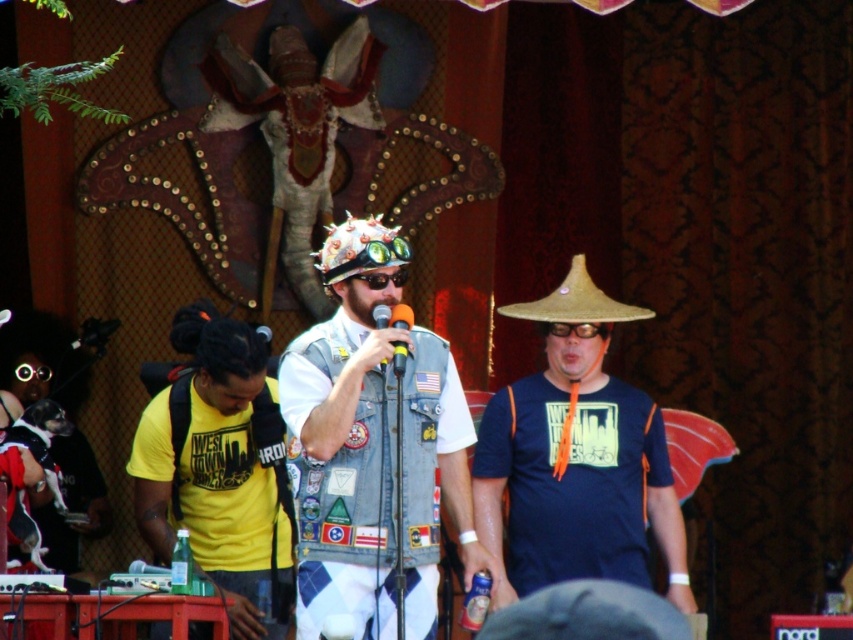
Question: Which point is farther to the camera?

Choices:
 (A) (448, 388)
 (B) (395, 355)

Answer: (A)

Question: Among these objects, which one is farthest from the camera?

Choices:
 (A) orange matte microphone at center
 (B) metallic silver microphone at center
 (C) yellow cotton t-shirt at left
 (D) denim vest at center

Answer: (C)

Question: Is dark blue cotton t-shirt at center above yellow cotton t-shirt at left?

Choices:
 (A) yes
 (B) no

Answer: (A)

Question: Is denim vest at center closer to the viewer compared to orange matte microphone at center?

Choices:
 (A) no
 (B) yes

Answer: (B)

Question: Is denim vest at center behind dark blue cotton t-shirt at center?

Choices:
 (A) yes
 (B) no

Answer: (B)

Question: Estimate the real-world distances between objects in this image. Which object is closer to the clear plastic goggles at center?

Choices:
 (A) metallic silver microphone at center
 (B) denim vest at center
 (C) yellow cotton t-shirt at left

Answer: (A)